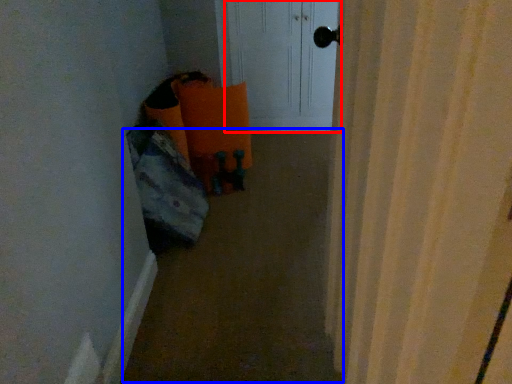
Question: Among these objects, which one is nearest to the camera, screen door (highlighted by a red box) or corridor (highlighted by a blue box)?

Choices:
 (A) screen door
 (B) corridor

Answer: (B)